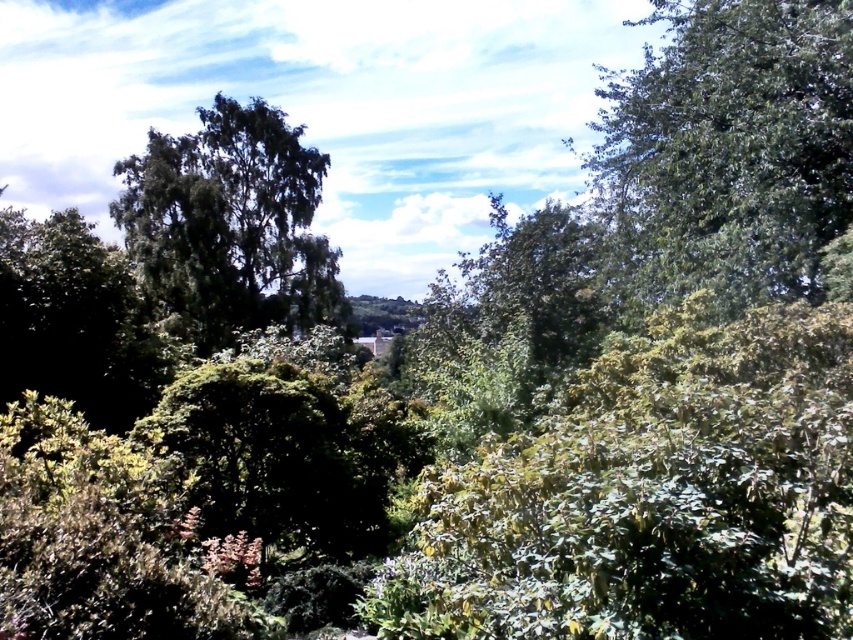
You are a bird looking for a nesting spot. You see two trees in the image, the green leafy tree at upper right and the green leafy tree at left. Which tree is located higher up in the image?

The green leafy tree at upper right is positioned over the green leafy tree at left, so it is higher up in the image.

Looking at this image, you are an ornithologist observing two green leafy trees in a forest. You notice a green leafy tree at upper right and a green leafy tree at left. Which tree is shorter?

The green leafy tree at upper right is shorter than the green leafy tree at left.